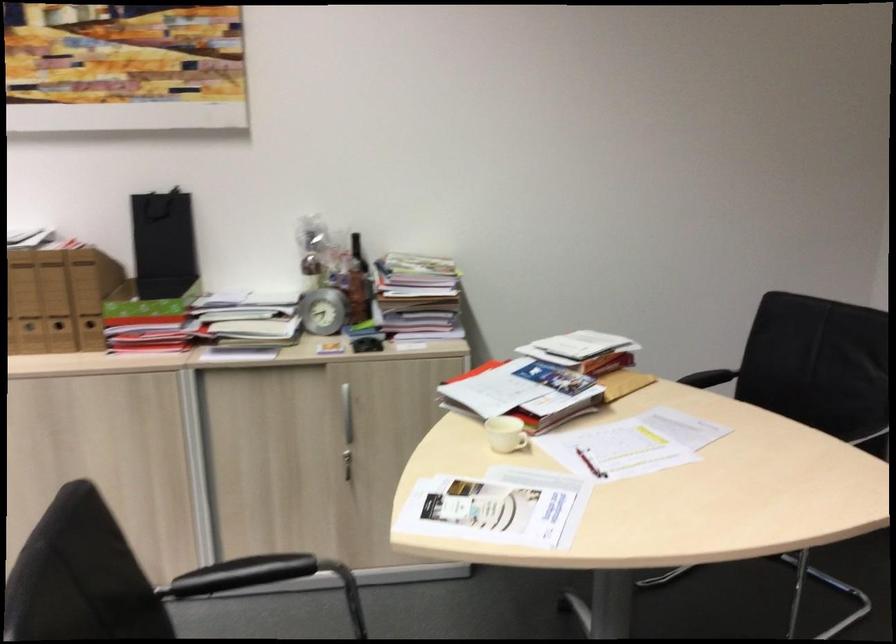
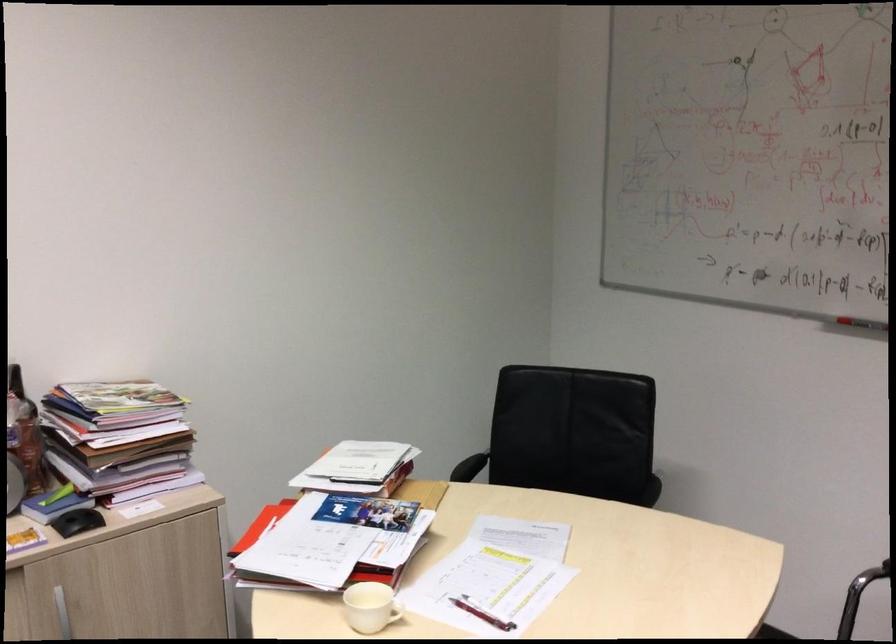
Where in the second image is the point corresponding to point 595,460 from the first image?

(481, 612)